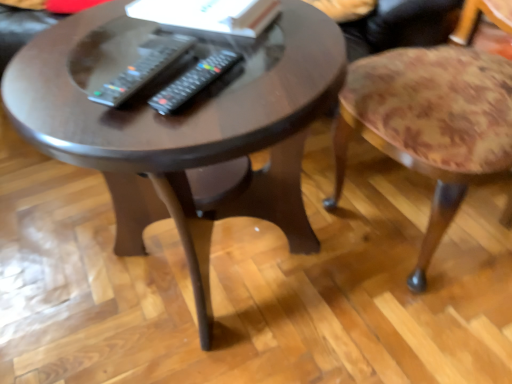
Question: Would you consider black plastic remote at center, acting as the 1th remote starting from the right, to be distant from black plastic remote at center, which ranks as the second remote in right-to-left order?

Choices:
 (A) no
 (B) yes

Answer: (A)

Question: Is black plastic remote at center, acting as the 1th remote starting from the right, directly adjacent to black plastic remote at center, which appears as the 1th remote when viewed from the left?

Choices:
 (A) yes
 (B) no

Answer: (A)

Question: Is black plastic remote at center, acting as the 1th remote starting from the right, wider than black plastic remote at center, which appears as the 1th remote when viewed from the left?

Choices:
 (A) yes
 (B) no

Answer: (B)

Question: Is black plastic remote at center, acting as the 1th remote starting from the right, smaller than black plastic remote at center, which appears as the 1th remote when viewed from the left?

Choices:
 (A) no
 (B) yes

Answer: (B)

Question: Is black plastic remote at center, marked as the second remote in a left-to-right arrangement, behind black plastic remote at center, which ranks as the second remote in right-to-left order?

Choices:
 (A) yes
 (B) no

Answer: (B)

Question: Can you confirm if black plastic remote at center, acting as the 1th remote starting from the right, is shorter than black plastic remote at center, which ranks as the second remote in right-to-left order?

Choices:
 (A) no
 (B) yes

Answer: (B)

Question: Can you confirm if black plastic remote at center, which ranks as the second remote in right-to-left order, is wider than black plastic remote at center, acting as the 1th remote starting from the right?

Choices:
 (A) no
 (B) yes

Answer: (B)

Question: Considering the relative sizes of black plastic remote at center, which ranks as the second remote in right-to-left order, and black plastic remote at center, marked as the second remote in a left-to-right arrangement, in the image provided, is black plastic remote at center, which ranks as the second remote in right-to-left order, thinner than black plastic remote at center, marked as the second remote in a left-to-right arrangement,?

Choices:
 (A) no
 (B) yes

Answer: (A)

Question: Is black plastic remote at center, marked as the second remote in a left-to-right arrangement, a part of black plastic remote at center, which ranks as the second remote in right-to-left order?

Choices:
 (A) yes
 (B) no

Answer: (B)

Question: Considering the relative sizes of black plastic remote at center, which appears as the 1th remote when viewed from the left, and black plastic remote at center, acting as the 1th remote starting from the right, in the image provided, is black plastic remote at center, which appears as the 1th remote when viewed from the left, smaller than black plastic remote at center, acting as the 1th remote starting from the right,?

Choices:
 (A) no
 (B) yes

Answer: (A)

Question: Is black plastic remote at center, which appears as the 1th remote when viewed from the left, looking in the opposite direction of black plastic remote at center, acting as the 1th remote starting from the right?

Choices:
 (A) no
 (B) yes

Answer: (A)

Question: Considering the relative sizes of black plastic remote at center, which appears as the 1th remote when viewed from the left, and black plastic remote at center, acting as the 1th remote starting from the right, in the image provided, is black plastic remote at center, which appears as the 1th remote when viewed from the left, taller than black plastic remote at center, acting as the 1th remote starting from the right,?

Choices:
 (A) yes
 (B) no

Answer: (A)

Question: Can we say dark wood coffee table at center lies outside black plastic remote at center, acting as the 1th remote starting from the right?

Choices:
 (A) yes
 (B) no

Answer: (A)